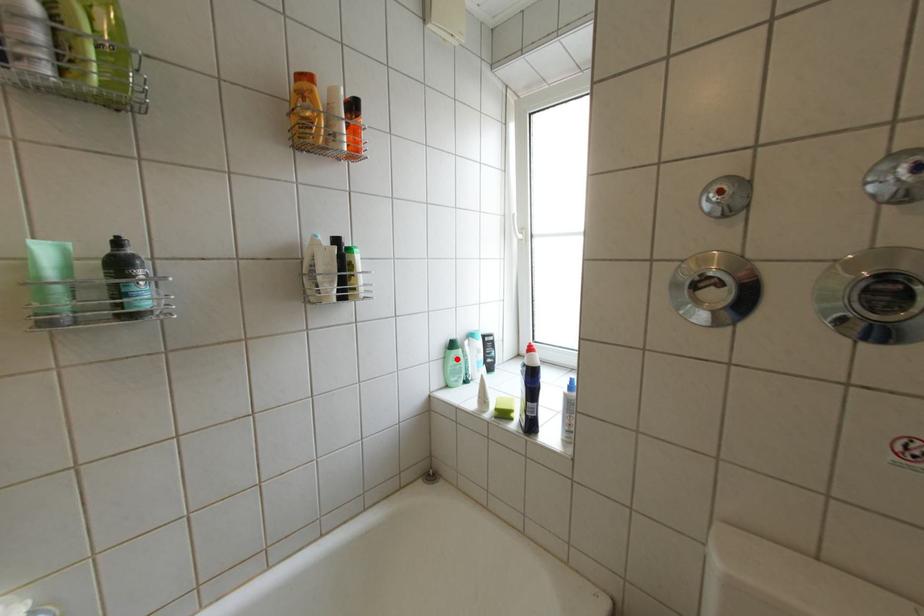
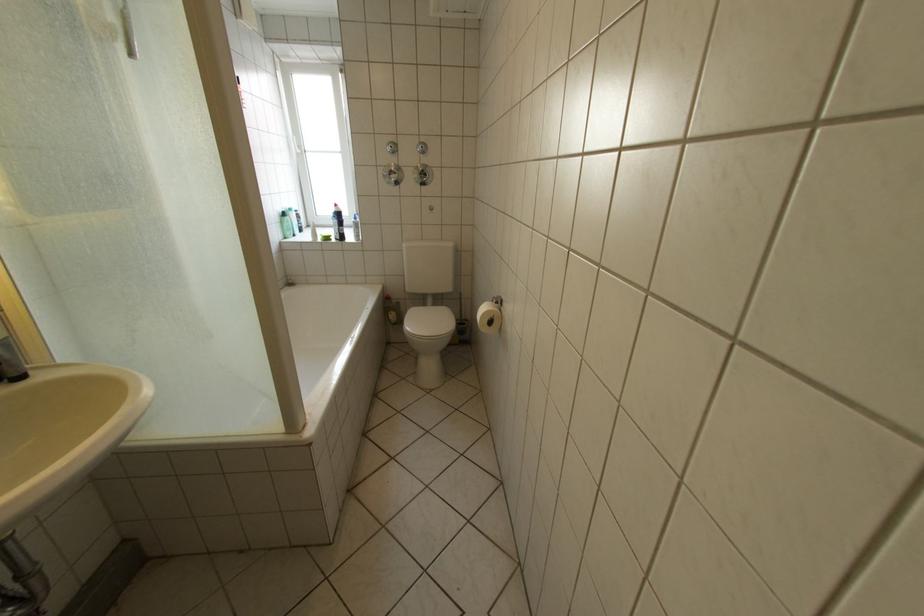
Question: I am providing you with two images of the same scene from different viewpoints. A red point is marked on the first image. Is the red point's position out of view in image 2?

Choices:
 (A) Yes
 (B) No

Answer: (B)